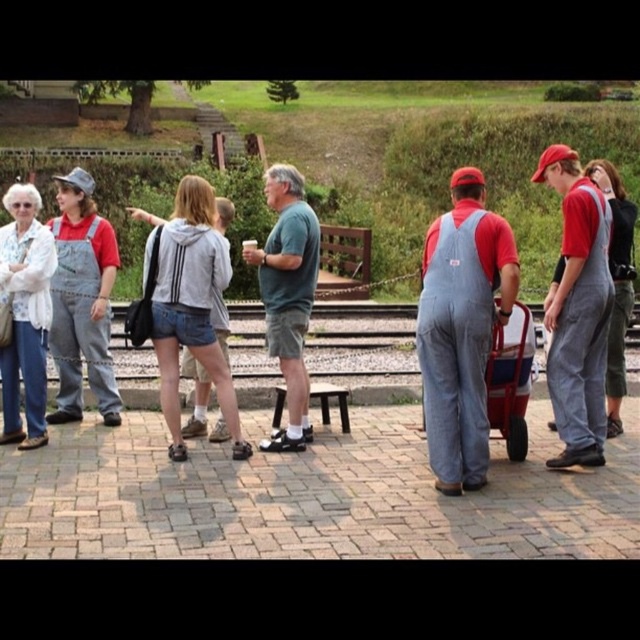
Question: Can you confirm if denim shorts at center is smaller than metallic red cart at center?

Choices:
 (A) yes
 (B) no

Answer: (A)

Question: Which of these objects is positioned closest to the matte gray overalls at left?

Choices:
 (A) denim shorts at center
 (B) gray denim overalls at right
 (C) metallic red cart at center
 (D) green cotton shirt at center

Answer: (A)

Question: Can you confirm if denim overalls at center is positioned to the left of white textured blouse at left?

Choices:
 (A) yes
 (B) no

Answer: (B)

Question: Can you confirm if matte gray overalls at left is positioned below green cotton shirt at center?

Choices:
 (A) yes
 (B) no

Answer: (B)

Question: Which object is the farthest from the denim shorts at center?

Choices:
 (A) green cotton shirt at center
 (B) gray denim overalls at right

Answer: (B)

Question: Which object appears farthest from the camera in this image?

Choices:
 (A) green cotton shirt at center
 (B) gray denim overalls at right

Answer: (A)